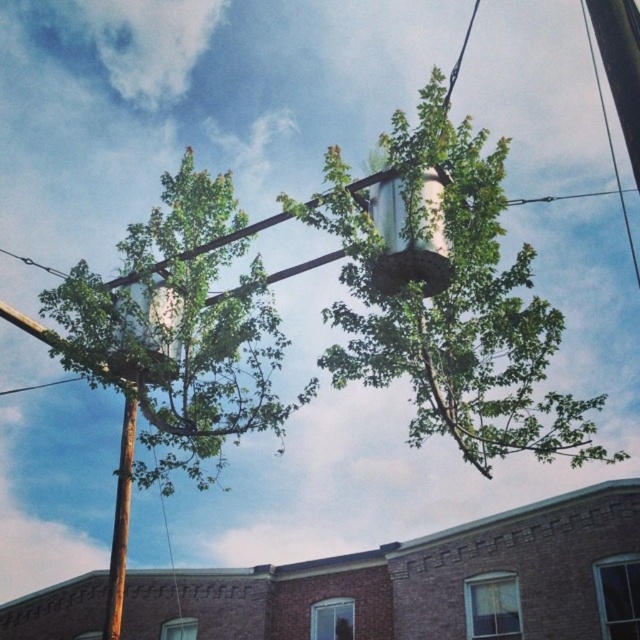
From the picture: You are standing at the base of the green leafy tree at center and want to throw a ball to a friend who is standing 10 meters away from the tree. Is your friend within the distance you can throw the ball?

The green leafy tree at center and viewer are 10.55 meters apart from each other. Since your friend is standing 10 meters away from the tree, they are within the distance you can throw the ball.

You are a bird flying over the scene and want to land on a tree. Which tree, the green leafy tree at center or the green leafy tree at upper left, is positioned higher in the image?

The green leafy tree at center is positioned higher in the image than the green leafy tree at upper left because it is located above it.